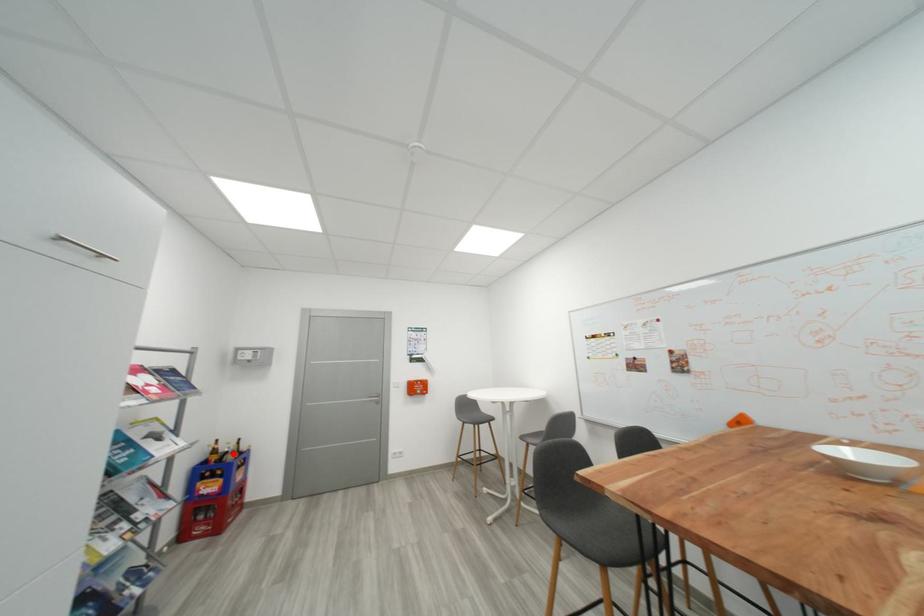
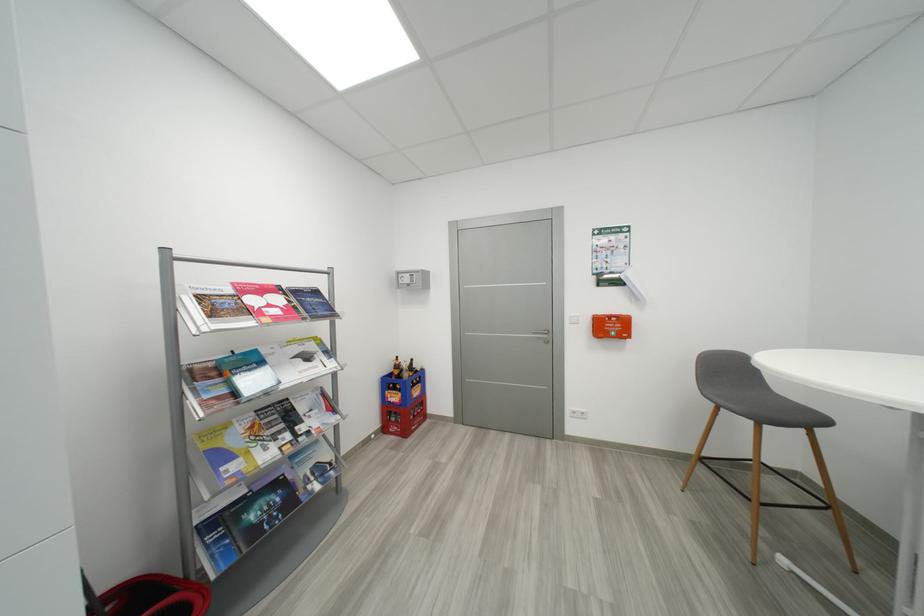
Question: I am providing you with two images of the same scene from different viewpoints. Given a red point in image1, look at the same physical point in image2. Is it:

Choices:
 (A) Closer to the viewpoint
 (B) Farther from the viewpoint

Answer: (B)